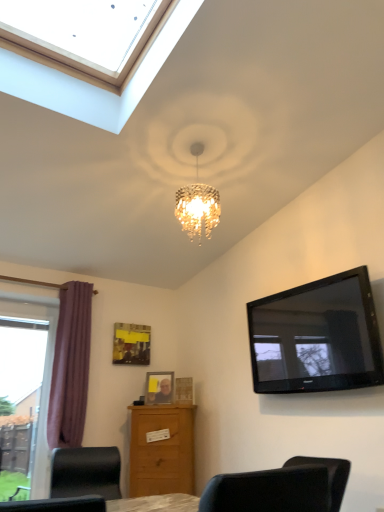
Question: Is wooden chest of drawers at lower center facing towards purple fabric curtain at left?

Choices:
 (A) yes
 (B) no

Answer: (B)

Question: Is wooden chest of drawers at lower center looking in the opposite direction of purple fabric curtain at left?

Choices:
 (A) yes
 (B) no

Answer: (B)

Question: Is wooden chest of drawers at lower center positioned far away from purple fabric curtain at left?

Choices:
 (A) no
 (B) yes

Answer: (A)

Question: Does wooden chest of drawers at lower center have a lesser width compared to purple fabric curtain at left?

Choices:
 (A) no
 (B) yes

Answer: (A)

Question: Can you confirm if wooden chest of drawers at lower center is positioned to the left of purple fabric curtain at left?

Choices:
 (A) yes
 (B) no

Answer: (B)

Question: From a real-world perspective, is wooden chest of drawers at lower center physically located above or below matte plastic picture frame at center, the 2th picture frame viewed from the right?

Choices:
 (A) below
 (B) above

Answer: (A)

Question: Would you say wooden chest of drawers at lower center is to the left or to the right of matte plastic picture frame at center, the second picture frame when ordered from left to right, in the picture?

Choices:
 (A) left
 (B) right

Answer: (B)

Question: In terms of height, does wooden chest of drawers at lower center look taller or shorter compared to matte plastic picture frame at center, the 2th picture frame viewed from the right?

Choices:
 (A) short
 (B) tall

Answer: (B)

Question: Relative to matte plastic picture frame at center, the second picture frame when ordered from left to right, is wooden chest of drawers at lower center in front or behind?

Choices:
 (A) behind
 (B) front

Answer: (B)

Question: Is matte yellow paper at upper center, the 3th picture frame from the right, inside the boundaries of purple fabric curtain at left, or outside?

Choices:
 (A) inside
 (B) outside

Answer: (B)

Question: From a real-world perspective, is matte yellow paper at upper center, which ranks as the first picture frame in left-to-right order, physically located above or below purple fabric curtain at left?

Choices:
 (A) above
 (B) below

Answer: (A)

Question: Does point (148, 347) appear closer or farther from the camera than point (86, 380)?

Choices:
 (A) farther
 (B) closer

Answer: (A)

Question: Considering the positions of matte yellow paper at upper center, the 3th picture frame from the right, and purple fabric curtain at left in the image, is matte yellow paper at upper center, the 3th picture frame from the right, taller or shorter than purple fabric curtain at left?

Choices:
 (A) tall
 (B) short

Answer: (B)

Question: Considering the positions of wooden chest of drawers at lower center and transparent glass window at left in the image, is wooden chest of drawers at lower center bigger or smaller than transparent glass window at left?

Choices:
 (A) big
 (B) small

Answer: (A)

Question: Is point (157, 443) positioned closer to the camera than point (41, 408)?

Choices:
 (A) closer
 (B) farther

Answer: (A)